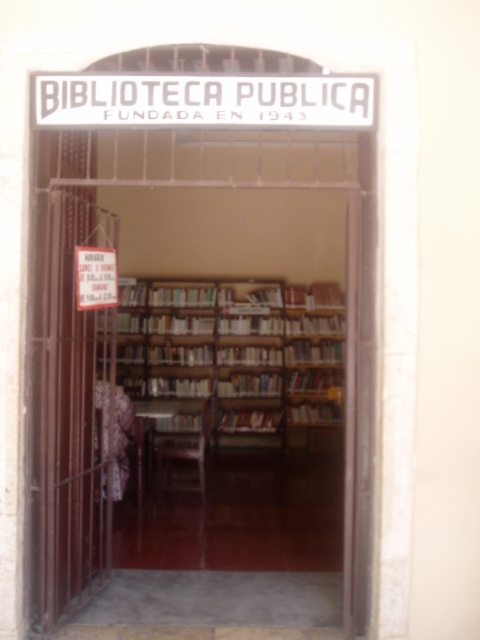
Question: Which object appears closest to the camera in this image?

Choices:
 (A) hardcover book at center
 (B) wooden bookcase at center

Answer: (B)

Question: Among these objects, which one is farthest from the camera?

Choices:
 (A) wooden bookcase at center
 (B) white paper sign at center

Answer: (A)

Question: Among these objects, which one is nearest to the camera?

Choices:
 (A) wooden bookcase at center
 (B) white metallic sign at upper center
 (C) hardcover book at center

Answer: (B)

Question: Can you confirm if wooden bookcase at center is positioned to the left of white metallic sign at upper center?

Choices:
 (A) no
 (B) yes

Answer: (A)

Question: Observing the image, what is the correct spatial positioning of wooden bookcase at center in reference to white metallic sign at upper center?

Choices:
 (A) below
 (B) above

Answer: (A)

Question: In this image, where is wooden bookcase at center located relative to hardcover book at center?

Choices:
 (A) below
 (B) above

Answer: (B)